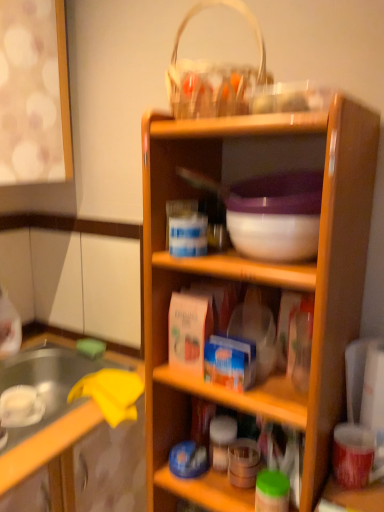
Question: Visually, is white woven basket at upper center positioned to the left or to the right of wooden cabinet at center?

Choices:
 (A) left
 (B) right

Answer: (B)

Question: From the image's perspective, relative to wooden cabinet at center, is white woven basket at upper center above or below?

Choices:
 (A) below
 (B) above

Answer: (B)

Question: Which is nearer to the white woven basket at upper center?

Choices:
 (A) wooden shelf at center
 (B) wooden cabinet at center

Answer: (A)

Question: Based on their relative distances, which object is nearer to the wooden cabinet at center?

Choices:
 (A) white woven basket at upper center
 (B) wooden shelf at center

Answer: (B)